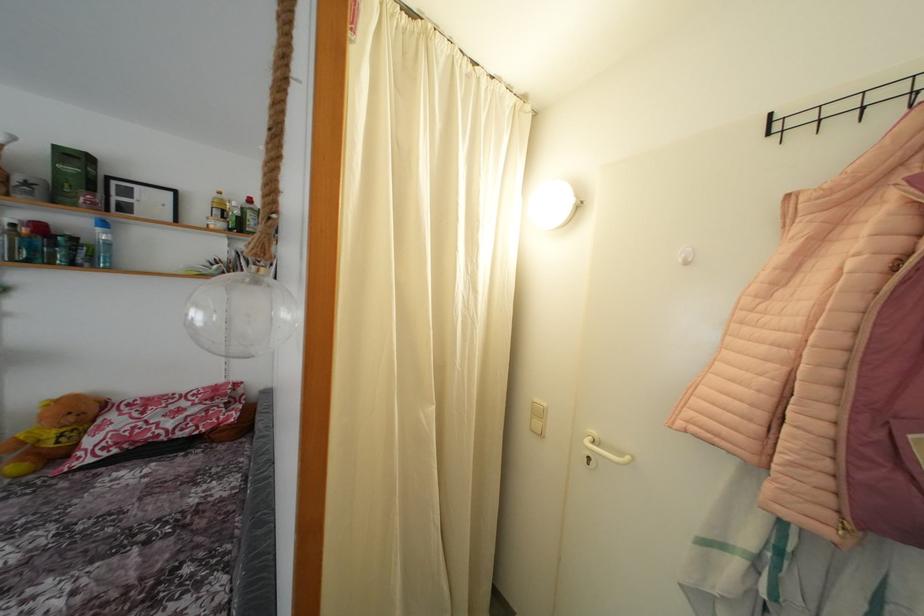
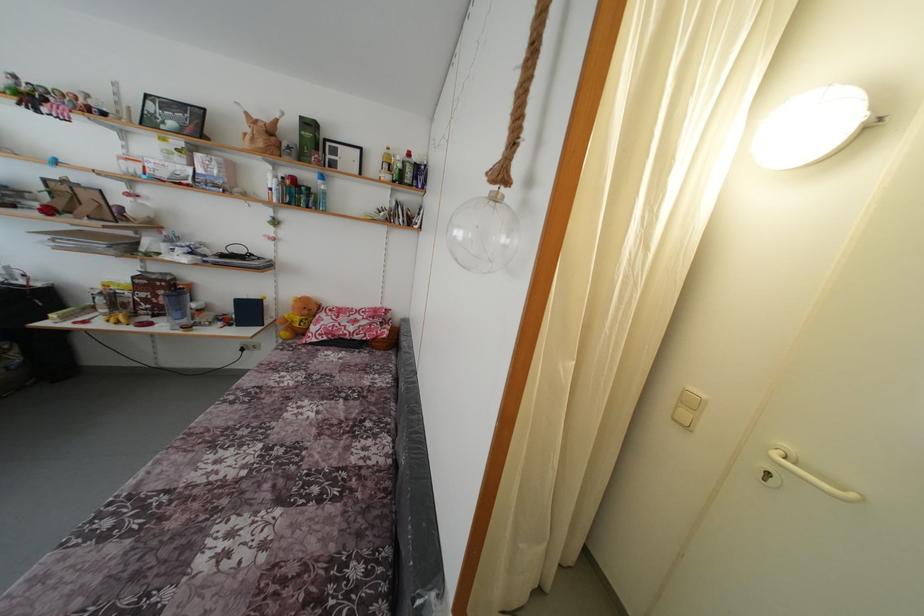
Question: In a continuous first-person perspective shot, in which direction is the camera moving?

Choices:
 (A) Left
 (B) Right
 (C) Forward
 (D) Backward

Answer: (A)